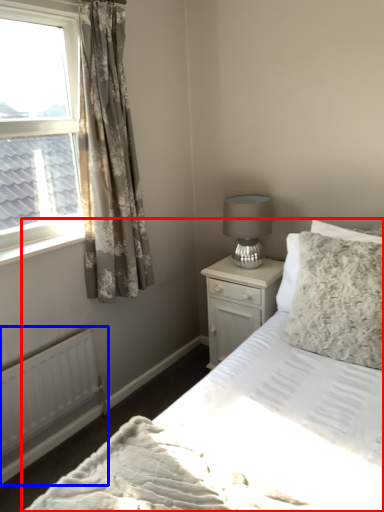
Question: Which object is further to the camera taking this photo, bed (highlighted by a red box) or radiator (highlighted by a blue box)?

Choices:
 (A) bed
 (B) radiator

Answer: (B)